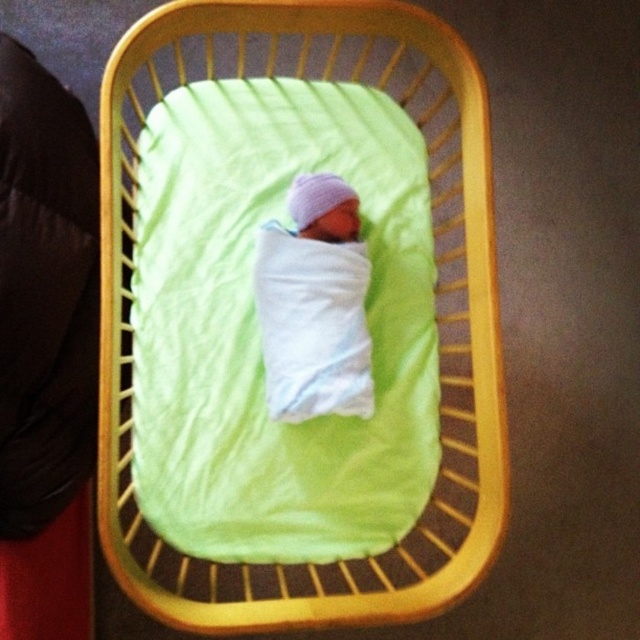
Question: Is wooden crib at center to the left of white soft swaddled newborn at center from the viewer's perspective?

Choices:
 (A) no
 (B) yes

Answer: (A)

Question: Among these points, which one is nearest to the camera?

Choices:
 (A) (292, 333)
 (B) (252, 612)

Answer: (B)

Question: Can you confirm if wooden crib at center is thinner than white soft swaddled newborn at center?

Choices:
 (A) no
 (B) yes

Answer: (A)

Question: Can you confirm if wooden crib at center is positioned to the left of white soft swaddled newborn at center?

Choices:
 (A) yes
 (B) no

Answer: (B)

Question: Among these points, which one is farthest from the camera?

Choices:
 (A) (118, 147)
 (B) (294, 196)

Answer: (B)